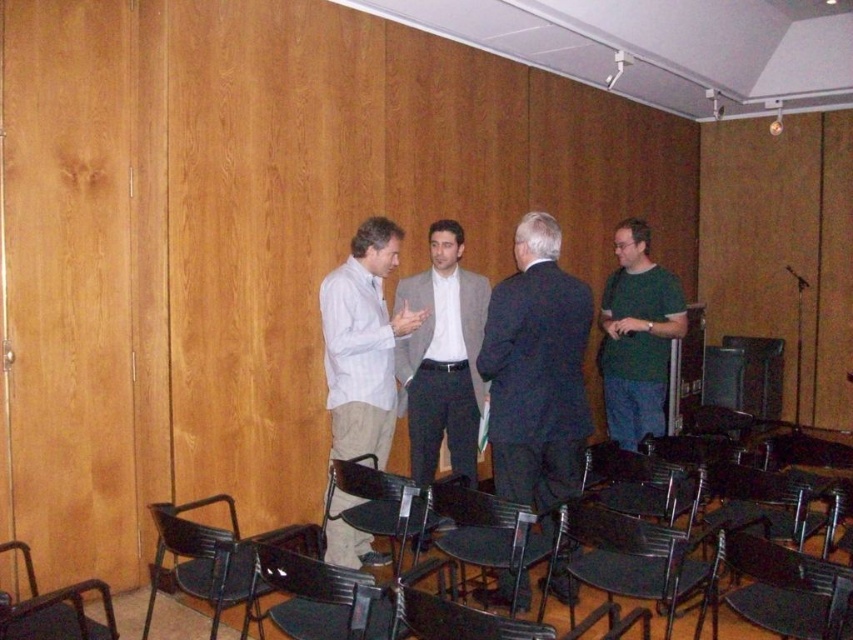
Does light beige cotton shirt at center appear on the left side of black plastic chair at lower center?

Incorrect, light beige cotton shirt at center is not on the left side of black plastic chair at lower center.

Is point (357, 438) farther from viewer compared to point (276, 586)?

Yes, point (357, 438) is behind point (276, 586).

Is point (350, 266) farther from camera compared to point (367, 620)?

Yes, it is.

Locate an element on the screen. The image size is (853, 640). light beige cotton shirt at center is located at coordinates (363, 342).

Does black plastic chair at lower center have a greater height compared to black plastic chair at lower left?

Indeed, black plastic chair at lower center has a greater height compared to black plastic chair at lower left.

Which is above, black plastic chair at lower center or black plastic chair at lower left?

black plastic chair at lower left

This screenshot has width=853, height=640. What are the coordinates of `black plastic chair at lower center` in the screenshot? It's located at (314, 596).

What are the coordinates of `black plastic chair at lower center` in the screenshot? It's located at point(314,596).

Can you confirm if dark blue suit at center is positioned above metallic black chair at lower left?

Yes, dark blue suit at center is above metallic black chair at lower left.

Does dark blue suit at center come in front of metallic black chair at lower left?

No.

Who is more distant from viewer, (x=550, y=433) or (x=189, y=524)?

Point (x=550, y=433)

The height and width of the screenshot is (640, 853). I want to click on dark blue suit at center, so click(537, 371).